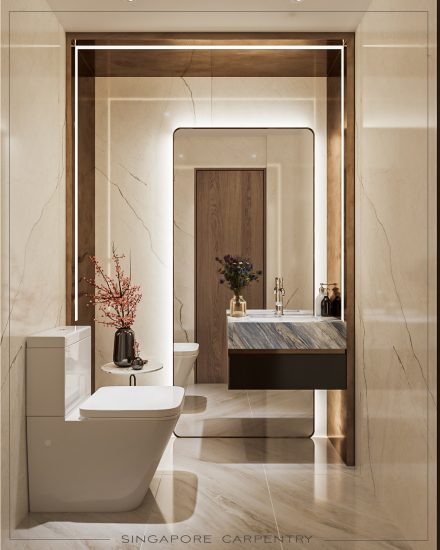
The width and height of the screenshot is (440, 550). I want to click on toilet, so click(111, 447).